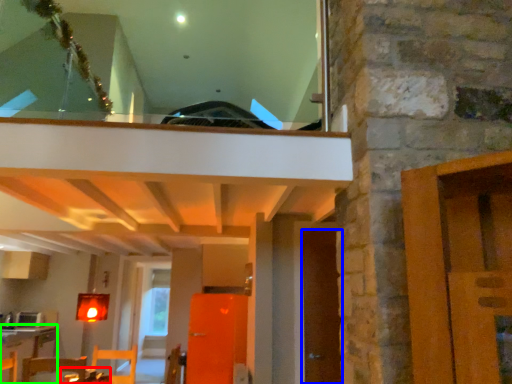
Question: Considering the real-world distances, which object is farthest from table (highlighted by a red box)? door (highlighted by a blue box) or table (highlighted by a green box)?

Choices:
 (A) door
 (B) table

Answer: (B)